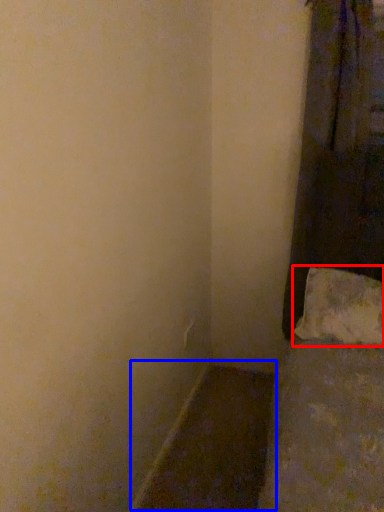
Question: Which object appears closest to the camera in this image, pillow (highlighted by a red box) or window sill (highlighted by a blue box)?

Choices:
 (A) pillow
 (B) window sill

Answer: (B)